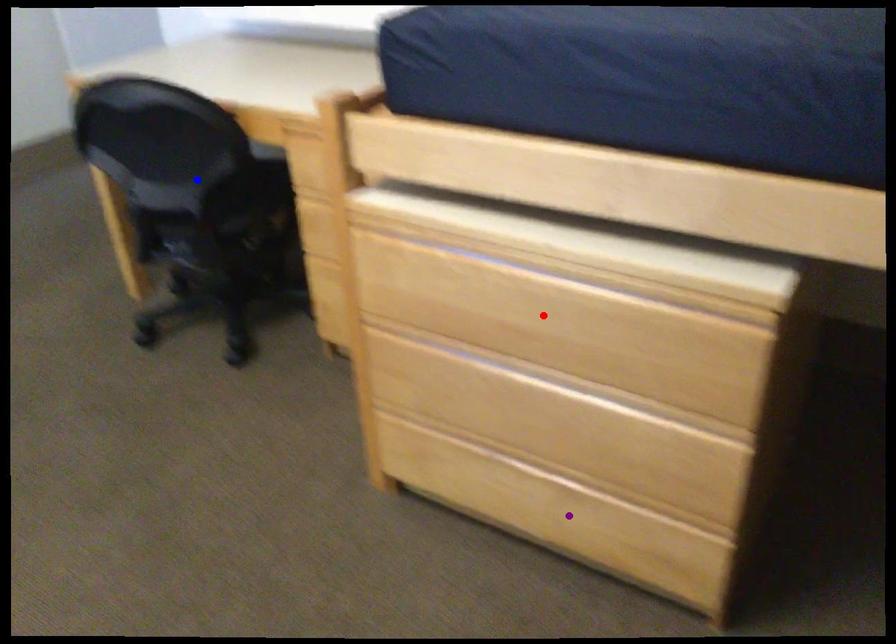
Order these from nearest to farthest:
blue point
purple point
red point

1. red point
2. purple point
3. blue point